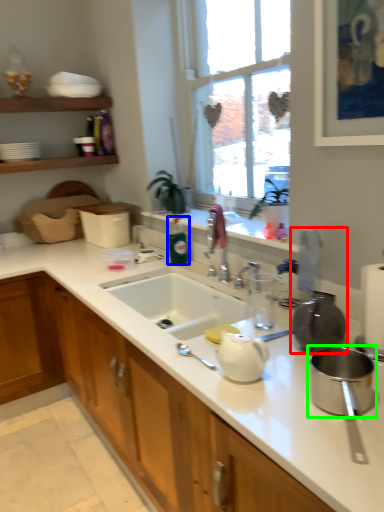
Question: Based on their relative distances, which object is farther from appliance (highlighted by a red box)? Choose from bottle (highlighted by a blue box) and appliance (highlighted by a green box).

Choices:
 (A) bottle
 (B) appliance

Answer: (A)